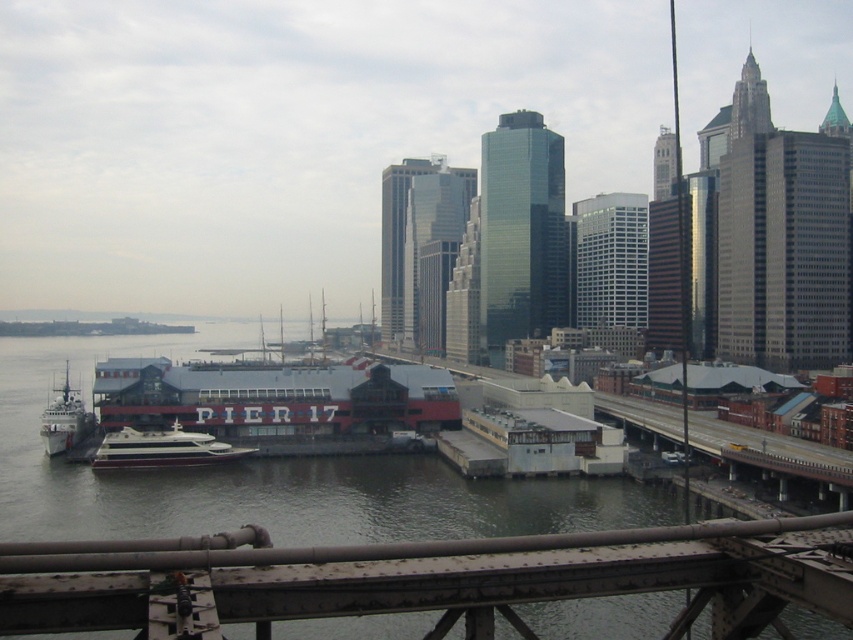
Is greenish-gray water at center further to the viewer compared to metallic gray ship at lower left?

No, greenish-gray water at center is in front of metallic gray ship at lower left.

In order to click on greenish-gray water at center in this screenshot , I will do `click(268, 476)`.

Which of these two, rusty metal bridge at lower center or metallic gray ship at lower left, stands shorter?

Standing shorter between the two is metallic gray ship at lower left.

Which is below, rusty metal bridge at lower center or metallic gray ship at lower left?

Positioned lower is rusty metal bridge at lower center.

This screenshot has width=853, height=640. In order to click on rusty metal bridge at lower center in this screenshot , I will do `click(425, 579)`.

Measure the distance between shiny white yacht at center and camera.

shiny white yacht at center is 111.77 meters from camera.

Which is more to the right, shiny white yacht at center or metallic gray ship at lower left?

Positioned to the right is shiny white yacht at center.

Where is `shiny white yacht at center`? The width and height of the screenshot is (853, 640). shiny white yacht at center is located at coordinates (161, 449).